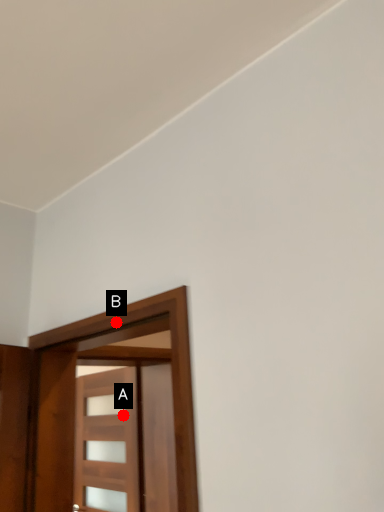
Question: Two points are circled on the image, labeled by A and B beside each circle. Which point appears farthest from the camera in this image?

Choices:
 (A) A is further
 (B) B is further

Answer: (A)